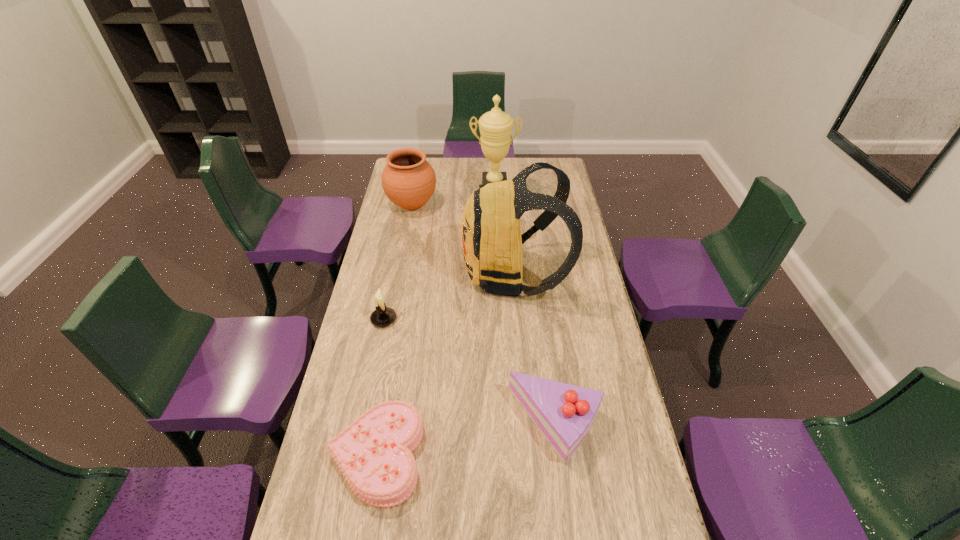
The height and width of the screenshot is (540, 960). I want to click on cake that is at the right edge, so click(x=564, y=413).

Locate an element on the screen. vacant area at the far edge is located at coordinates (450, 176).

I want to click on free spot at the left edge of the desktop, so click(387, 255).

Where is `free space at the right edge`? This screenshot has width=960, height=540. free space at the right edge is located at coordinates (586, 278).

Where is `free region at the far right corner of the desktop`? The image size is (960, 540). free region at the far right corner of the desktop is located at coordinates (555, 160).

I want to click on vacant point located between the second tallest object and the left cake, so click(x=445, y=364).

The height and width of the screenshot is (540, 960). Identify the location of free space between the shorter cake and the third farthest object. (445, 364).

Where is `free space between the right cake and the fourth nearest object`? The height and width of the screenshot is (540, 960). free space between the right cake and the fourth nearest object is located at coordinates (535, 349).

Where is `empty location between the third nearest object and the left cake`? This screenshot has width=960, height=540. empty location between the third nearest object and the left cake is located at coordinates (380, 387).

Find the location of `blank region between the taller cake and the third nearest object`. blank region between the taller cake and the third nearest object is located at coordinates pyautogui.click(x=469, y=372).